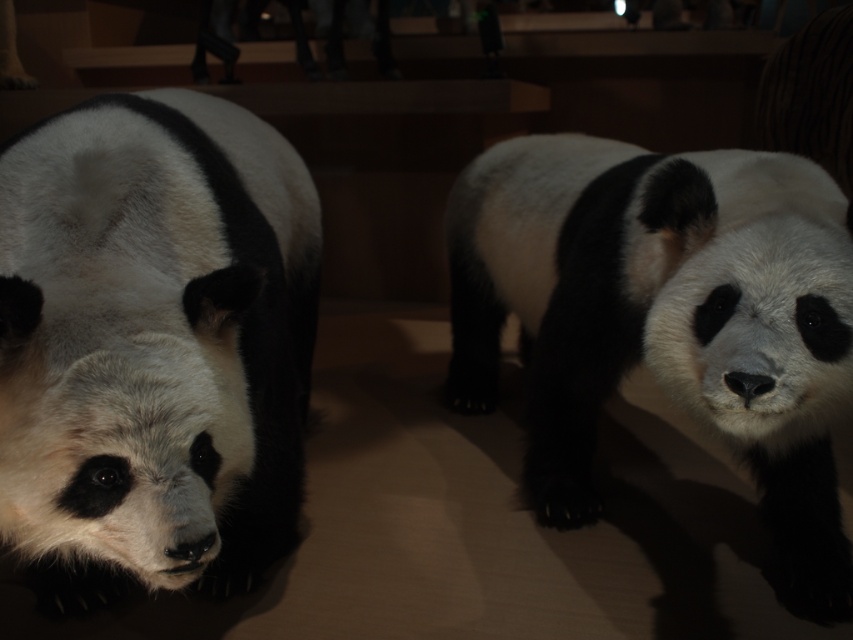
Question: Can you confirm if black and white fur panda at left is positioned above black and white fur panda at center?

Choices:
 (A) no
 (B) yes

Answer: (A)

Question: Observing the image, what is the correct spatial positioning of black and white fur panda at left in reference to black and white fur panda at center?

Choices:
 (A) right
 (B) left

Answer: (B)

Question: Which point is farther from the camera taking this photo?

Choices:
 (A) (123, 435)
 (B) (831, 316)

Answer: (B)

Question: Which object appears closest to the camera in this image?

Choices:
 (A) black and white fur panda at center
 (B) black and white fur panda at left

Answer: (B)

Question: Where is black and white fur panda at left located in relation to black and white fur panda at center in the image?

Choices:
 (A) left
 (B) right

Answer: (A)